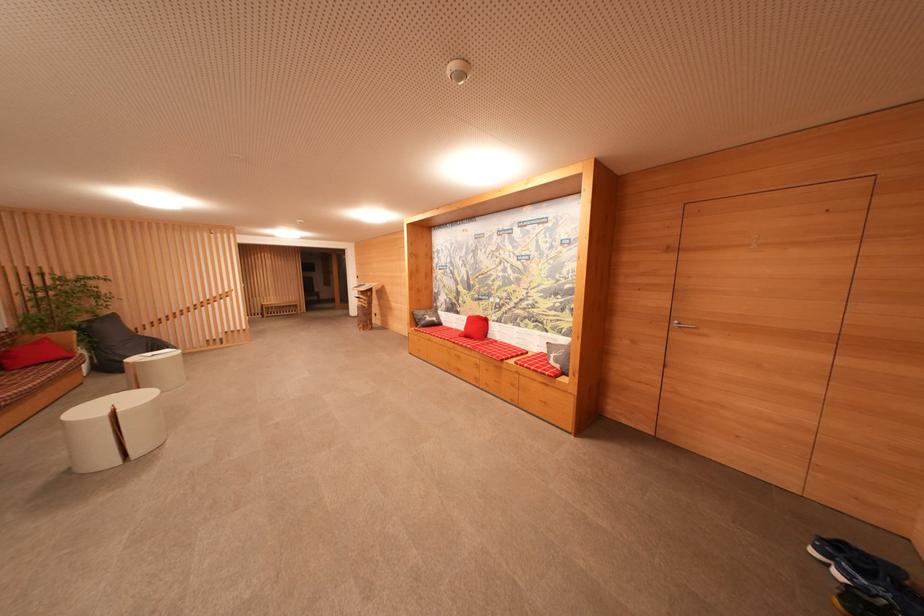
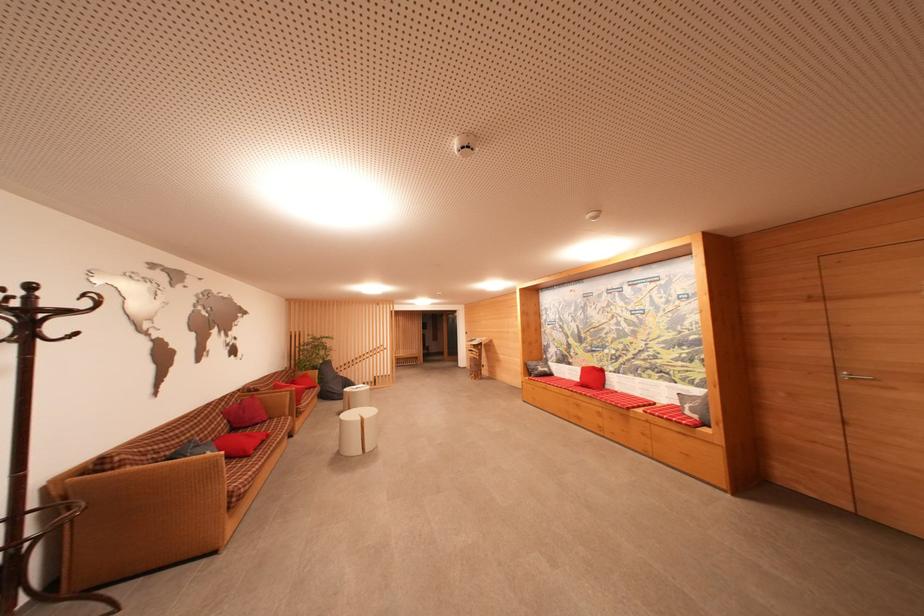
Find the pixel in the second image that matches the point at 710,339 in the first image.

(898, 392)